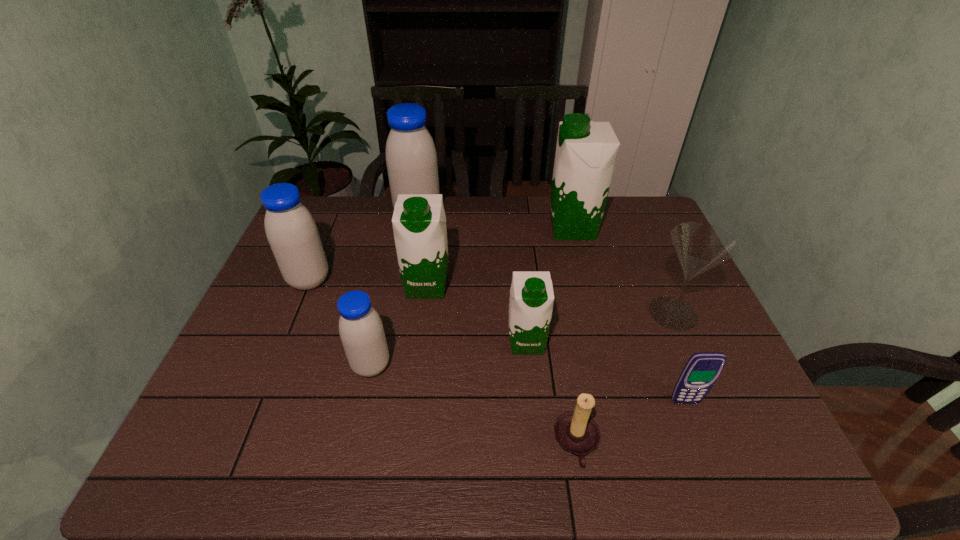
I want to click on the biggest green soya milk, so click(x=586, y=151).

Where is `the farthest green soya milk`? Image resolution: width=960 pixels, height=540 pixels. the farthest green soya milk is located at coordinates (586, 151).

Image resolution: width=960 pixels, height=540 pixels. Find the location of `the biggest blue soya milk`. the biggest blue soya milk is located at coordinates (411, 158).

Find the location of `the leftmost soya milk`. the leftmost soya milk is located at coordinates (291, 231).

Find the location of a particular element. The height and width of the screenshot is (540, 960). the leftmost object is located at coordinates (291, 231).

Locate an element on the screen. The height and width of the screenshot is (540, 960). the second smallest green soya milk is located at coordinates (419, 221).

Locate an element on the screen. The height and width of the screenshot is (540, 960). the leftmost green soya milk is located at coordinates 419,221.

What are the coordinates of `flute glass` in the screenshot? It's located at (700, 247).

Find the location of a particular element. The image size is (960, 540). the second soya milk from right to left is located at coordinates (531, 300).

Locate an element on the screen. This screenshot has width=960, height=540. the nearest green soya milk is located at coordinates (531, 300).